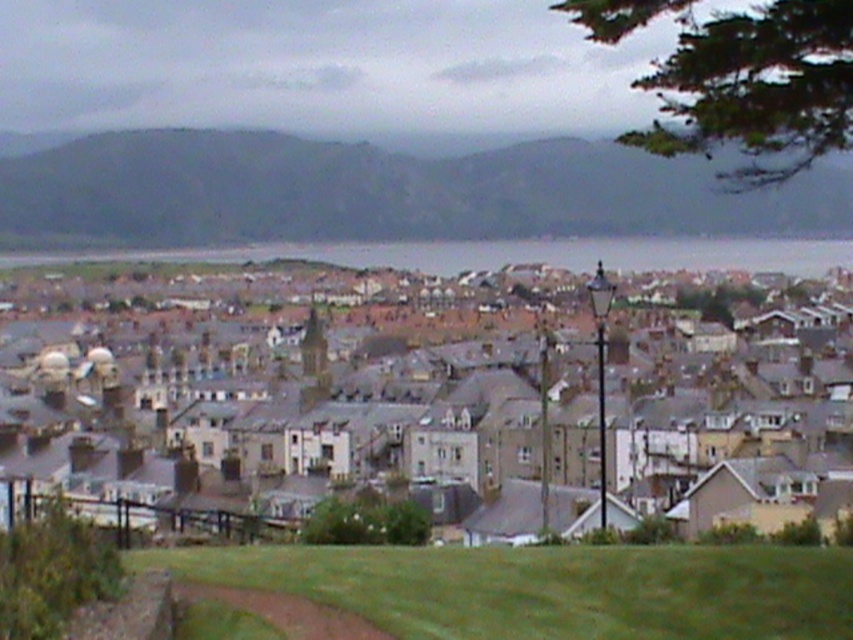
You are an architect planning to build a new structure in the town. You want to ensure that your new building does not exceed the width of the existing gray stone houses at center. Given that the gray rocky hillside at upper left is wider, can you determine if the new building can be wider than the hillside?

The gray stone houses at center has a lesser width compared to gray rocky hillside at upper left. Therefore, the new building cannot be wider than the hillside if it must not exceed the width of the existing gray stone houses at center.

Based on the photo, you are a drone operator trying to capture a photo of the gray stone houses at center and the green grass at lower center. If the camera has a fixed focal length, which area should you focus on to ensure both are in frame without moving the camera?

The gray stone houses at center should be the focus since their width is larger than the green grass at lower center, ensuring both fit within the frame when centered on the wider area.